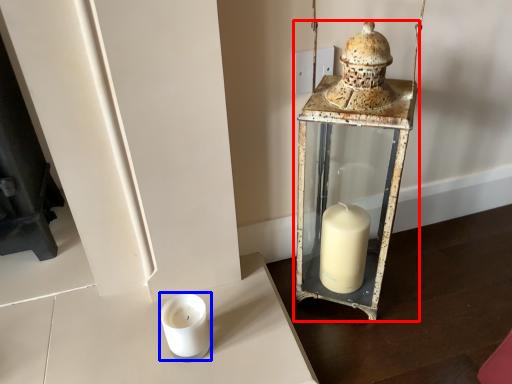
Question: Which of the following is the farthest to the observer, lantern (highlighted by a red box) or candle holder (highlighted by a blue box)?

Choices:
 (A) lantern
 (B) candle holder

Answer: (B)